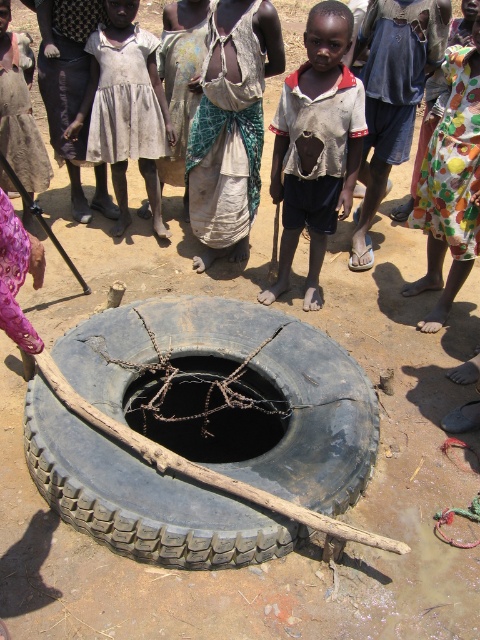
You are a parent trying to locate your child who is wearing a ripped white shirt. You see the ripped white shirt at center and the white cotton dress at center near the well. How far apart are these two items?

The ripped white shirt at center is 4.61 feet away from the white cotton dress at center.

You are standing at the well and want to reach a point that is exactly 15 feet away from you. Is the point at coordinates point (314, 305) within that range?

The point at point (314, 305) is 14.99 feet away from the viewer, so yes, it is within the 15 feet range.